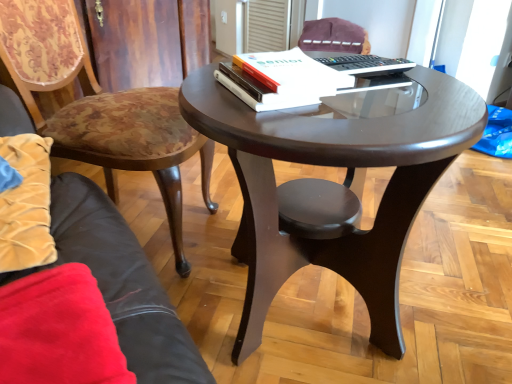
This screenshot has width=512, height=384. Find the location of `vacant space in front of white plastic remote control at upper center`. vacant space in front of white plastic remote control at upper center is located at coordinates (423, 97).